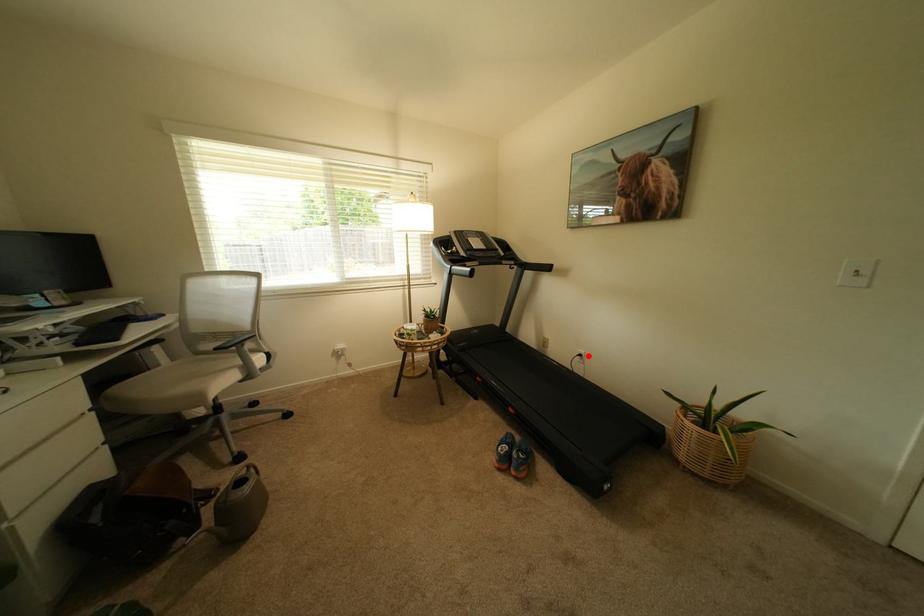
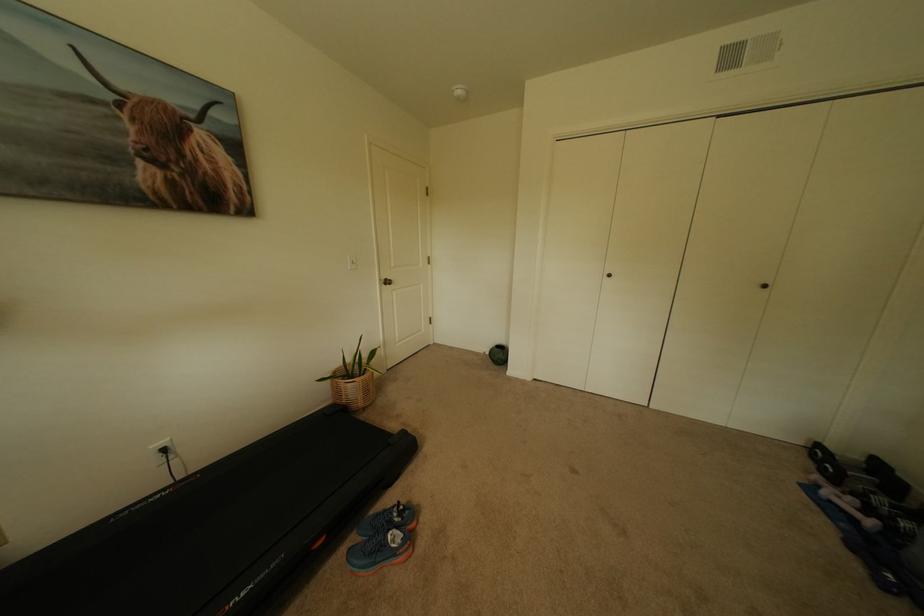
Question: I am providing you with two images of the same scene from different viewpoints. A red point is shown in image1. For the corresponding object point in image2, is it positioned nearer or farther from the camera?

Choices:
 (A) Nearer
 (B) Farther

Answer: (B)